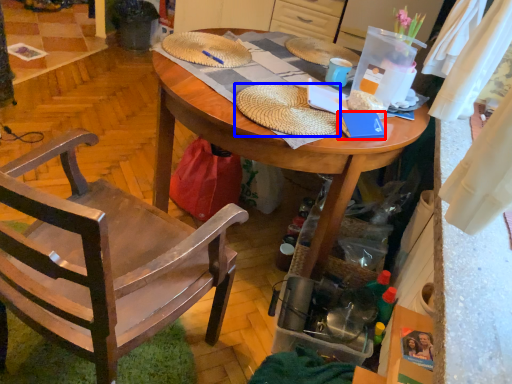
Question: Among these objects, which one is nearest to the camera, book (highlighted by a red box) or hat (highlighted by a blue box)?

Choices:
 (A) book
 (B) hat

Answer: (B)